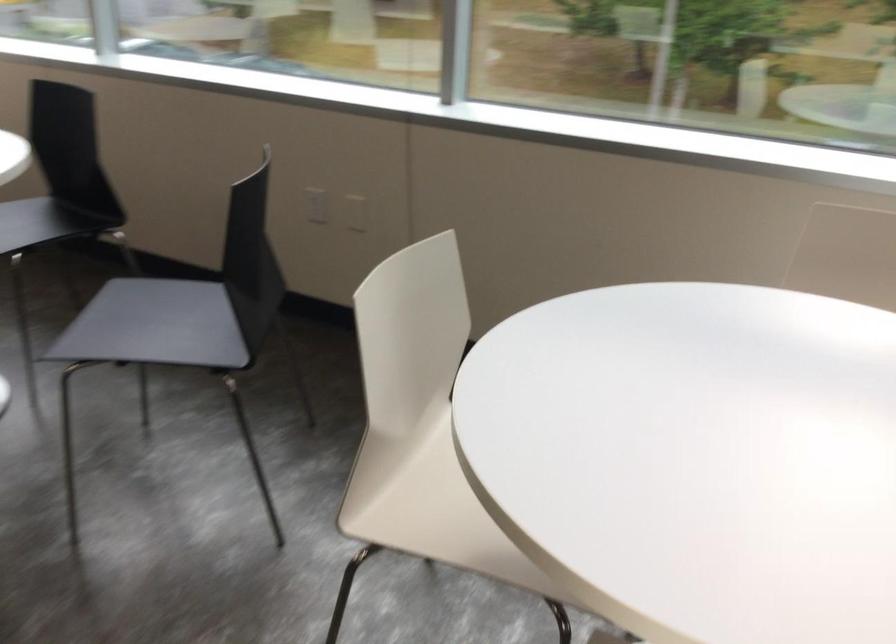
This screenshot has height=644, width=896. What do you see at coordinates (431, 509) in the screenshot? I see `the white chair sitting surface` at bounding box center [431, 509].